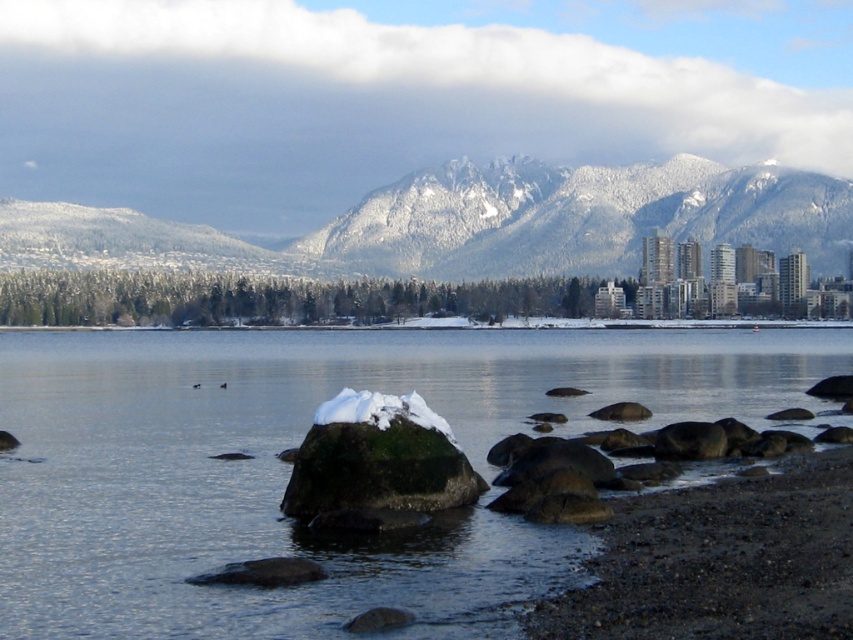
Is point (476, 173) behind point (381, 403)?

Yes, point (476, 173) is behind point (381, 403).

Between snowy granite mountains at upper center and white fluffy snow at center, which one appears on the left side from the viewer's perspective?

From the viewer's perspective, snowy granite mountains at upper center appears more on the left side.

Which is in front, point (729, 196) or point (341, 403)?

Point (341, 403) is in front.

In order to click on snowy granite mountains at upper center in this screenshot , I will do `click(474, 224)`.

The image size is (853, 640). Describe the element at coordinates (289, 465) in the screenshot. I see `clear water at center` at that location.

Does clear water at center appear on the right side of white fluffy snow at center?

Indeed, clear water at center is positioned on the right side of white fluffy snow at center.

Is point (167, 358) in front of point (328, 416)?

No, (167, 358) is further to viewer.

I want to click on clear water at center, so click(x=289, y=465).

Is point (215, 342) more distant than point (343, 225)?

That is False.

Between point (782, 339) and point (396, 198), which one is positioned in front?

Point (782, 339) is in front.

Image resolution: width=853 pixels, height=640 pixels. Find the location of `clear water at center`. clear water at center is located at coordinates (289, 465).